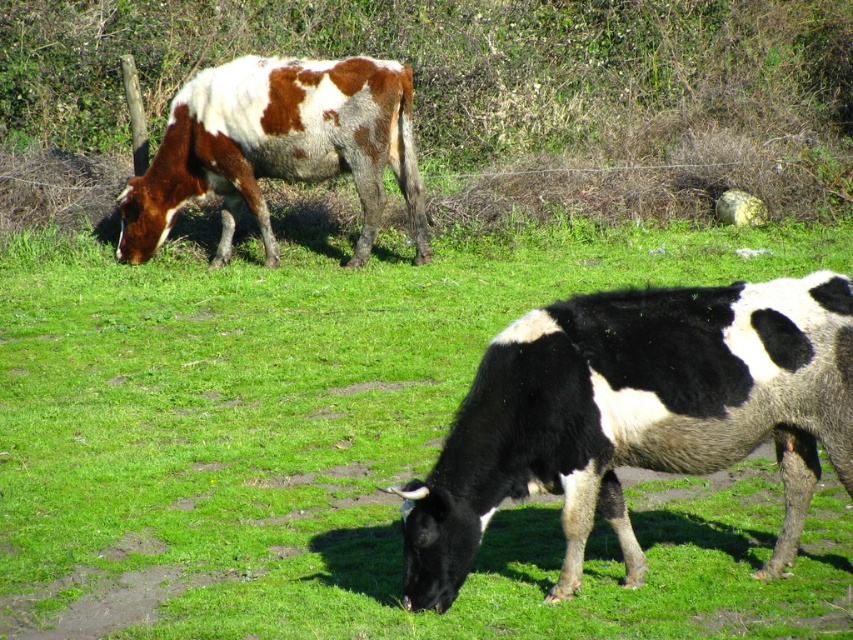
Question: Is black and white fur at lower right closer to camera compared to brown spotted fur at upper left?

Choices:
 (A) no
 (B) yes

Answer: (B)

Question: Can you confirm if black and white cow at center is positioned to the right of brown spotted fur at upper left?

Choices:
 (A) no
 (B) yes

Answer: (B)

Question: Which of the following is the farthest from the observer?

Choices:
 (A) pyautogui.click(x=219, y=100)
 (B) pyautogui.click(x=483, y=387)

Answer: (A)

Question: Is black and white cow at center above brown spotted fur at upper left?

Choices:
 (A) yes
 (B) no

Answer: (B)

Question: Which of the following is the closest to the observer?

Choices:
 (A) (415, 609)
 (B) (248, 84)
 (C) (271, 474)

Answer: (A)

Question: Which point is closer to the camera?

Choices:
 (A) (625, 428)
 (B) (404, 67)
 (C) (10, 365)

Answer: (A)